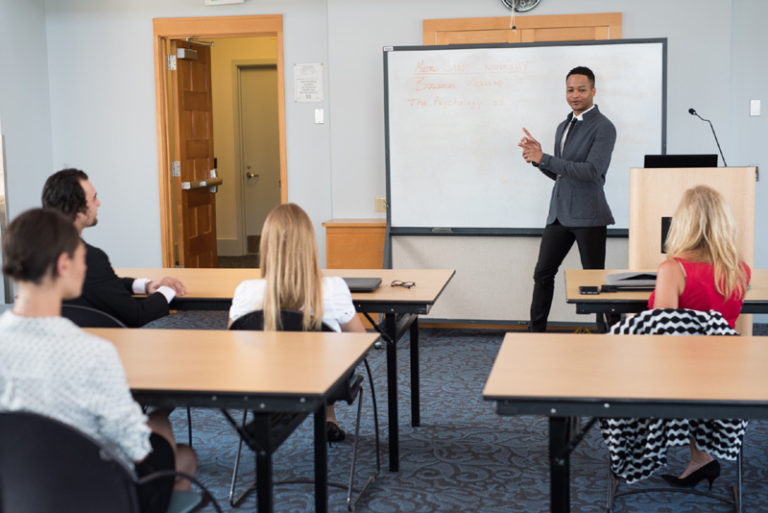
The height and width of the screenshot is (513, 768). I want to click on desks, so click(560, 374), click(224, 384), click(220, 275), click(588, 279).